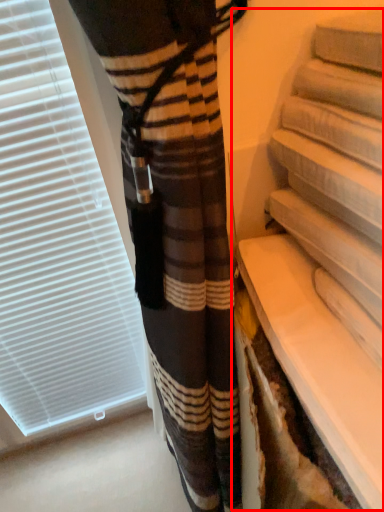
Question: Where is shelf (annotated by the red box) located in relation to window blind in the image?

Choices:
 (A) left
 (B) right

Answer: (B)